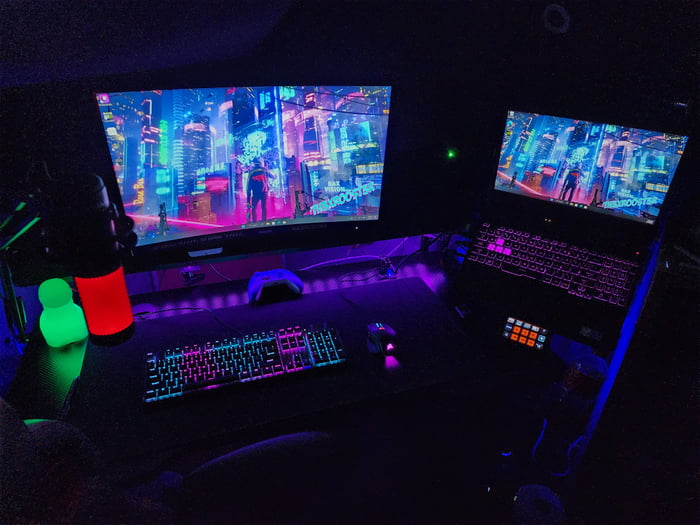
Where is `keyboard for the moinitor`? keyboard for the moinitor is located at coordinates point(266,354).